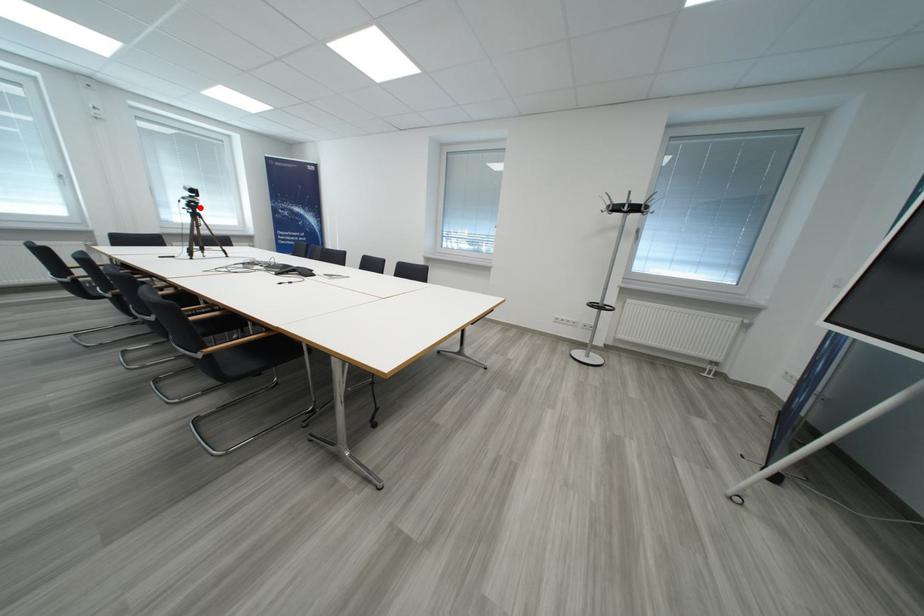
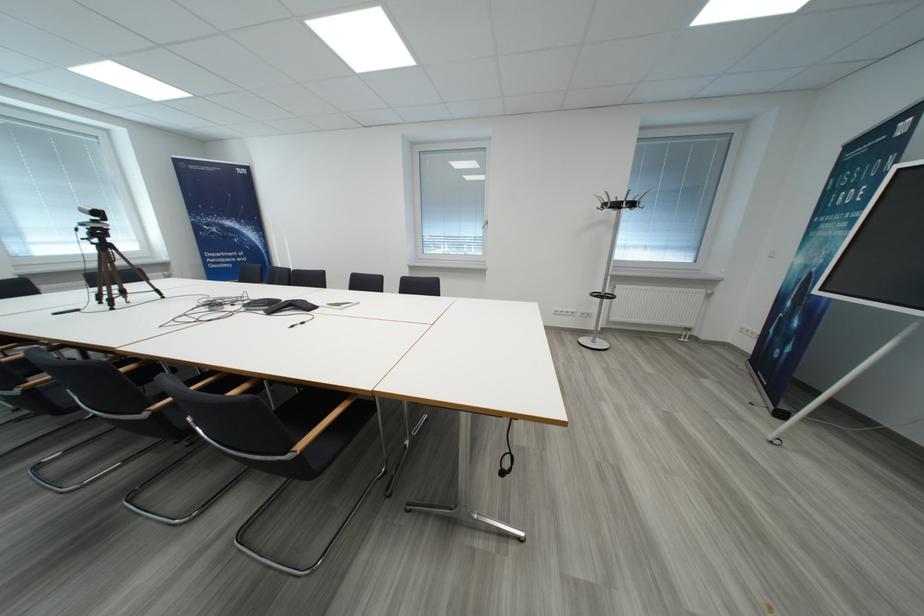
The point at the highlighted location is marked in the first image. Where is the corresponding point in the second image?

(106, 236)